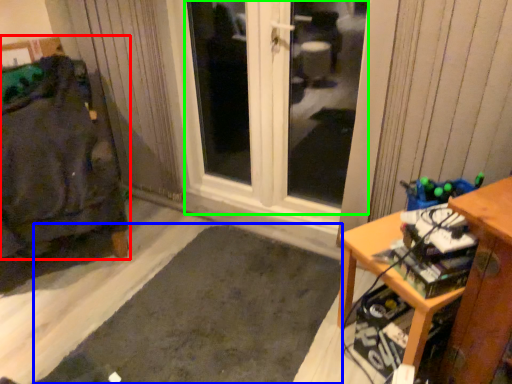
Question: Based on their relative distances, which object is farther from furniture (highlighted by a red box)? Choose from doormat (highlighted by a blue box) and window (highlighted by a green box).

Choices:
 (A) doormat
 (B) window

Answer: (B)